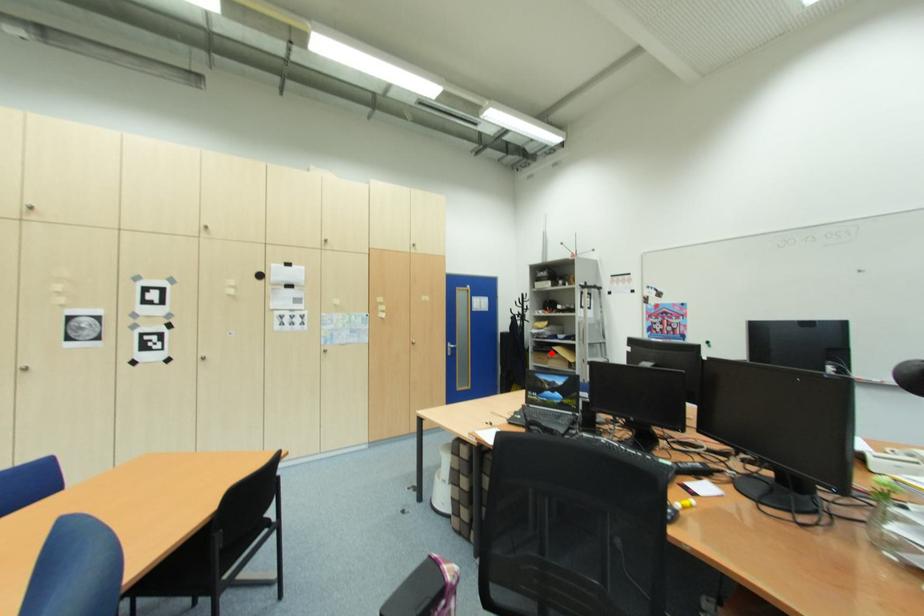
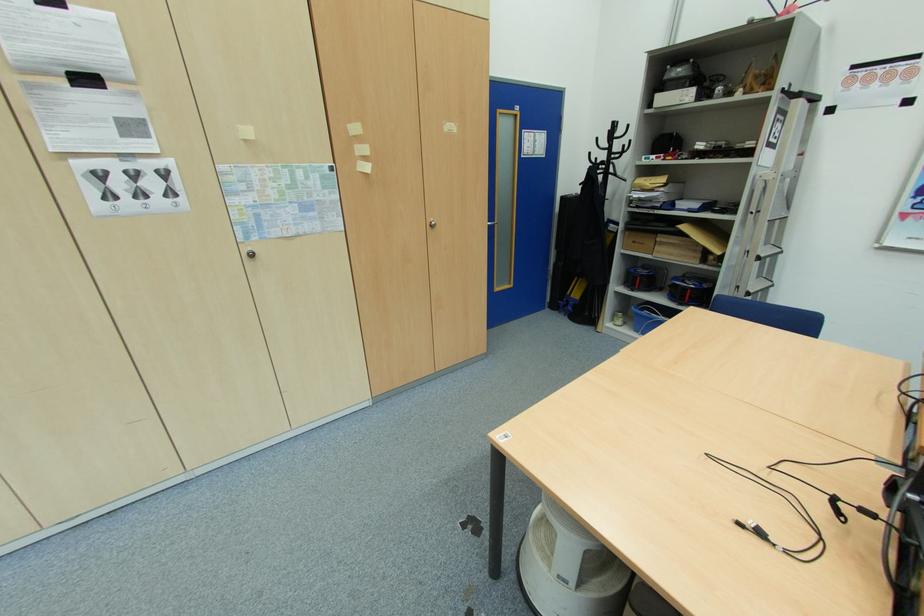
Question: I am providing you with two images of the same scene from different viewpoints. In image1, a red point is highlighted. Considering the same 3D point in image2, which of the following is correct?

Choices:
 (A) It is closer
 (B) It is farther

Answer: (A)